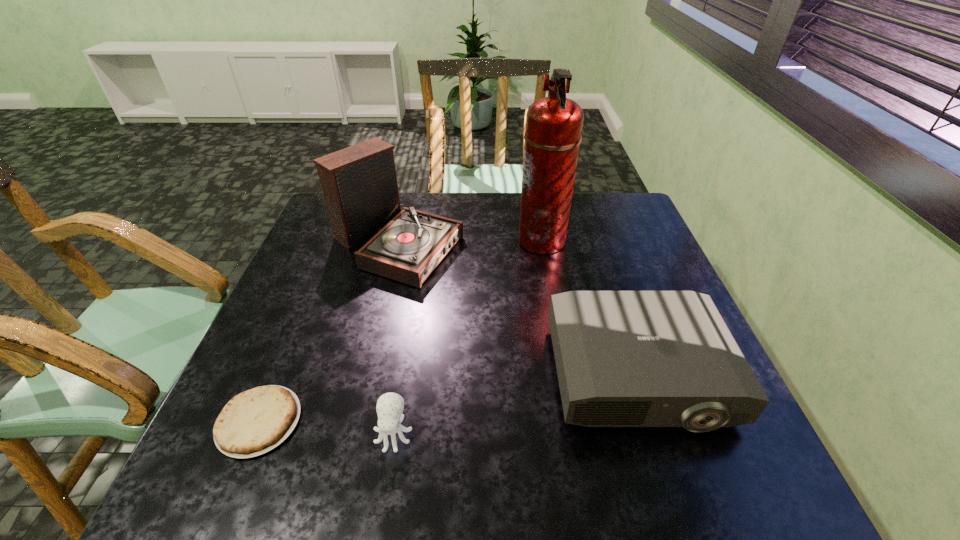
This screenshot has width=960, height=540. Find the location of `free space at the far edge of the desktop`. free space at the far edge of the desktop is located at coordinates (467, 222).

Find the location of a particular element. free space at the near edge is located at coordinates (648, 491).

Locate an element on the screen. vacant region at the left edge is located at coordinates (331, 268).

Locate an element on the screen. vacant position at the far right corner of the desktop is located at coordinates (594, 193).

Where is `unoccupied position between the second tallest object and the octopus`? This screenshot has width=960, height=540. unoccupied position between the second tallest object and the octopus is located at coordinates (396, 338).

I want to click on vacant area between the tortilla and the third shortest object, so click(x=448, y=399).

Identify the location of free space between the fourth shortest object and the octopus. (396, 338).

The width and height of the screenshot is (960, 540). Identify the location of vacant area between the fire extinguisher and the octopus. [x=468, y=337].

Where is `free area in between the fourth shortest object and the third shortest object`? free area in between the fourth shortest object and the third shortest object is located at coordinates [517, 309].

Locate an element on the screen. Image resolution: width=960 pixels, height=540 pixels. vacant point located between the tortilla and the phonograph record is located at coordinates (328, 332).